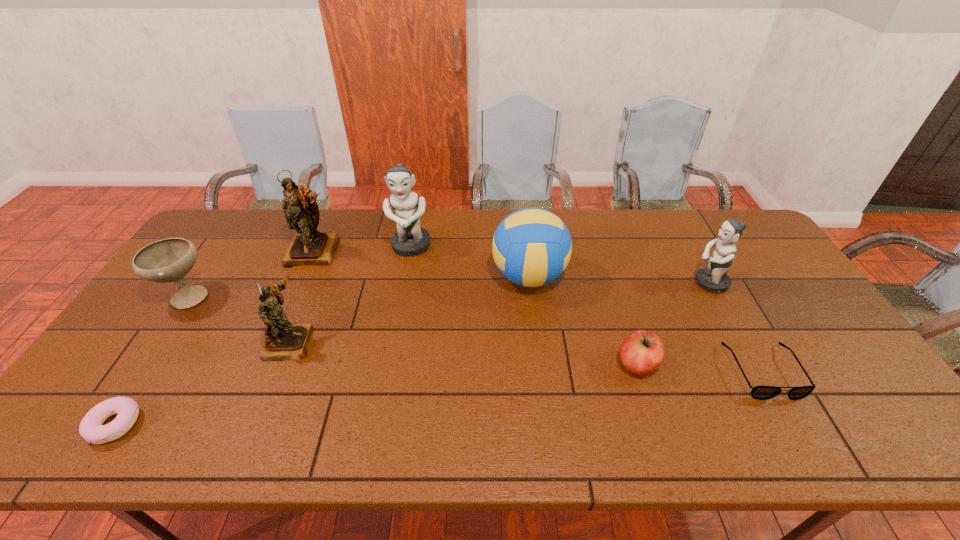
Where is `vacant point located between the volleyball and the spectacles`? vacant point located between the volleyball and the spectacles is located at coordinates (646, 324).

You are a GUI agent. You are given a task and a screenshot of the screen. Output one action in this format:
    pyautogui.click(x=<x>, y=<y>)
    Task: Click on the free space between the sixth tallest object and the pink doughnut
    This screenshot has width=960, height=540.
    Given the screenshot: What is the action you would take?
    pyautogui.click(x=152, y=360)

Where is `unoccupied area between the black spectacles and the seventh object from left to right`? This screenshot has width=960, height=540. unoccupied area between the black spectacles and the seventh object from left to right is located at coordinates (700, 368).

Select which object is the second closest to the smaller gold figurine. Please provide its 2D coordinates. Your answer should be formatted as a tuple, i.e. [(x, y)], where the tuple contains the x and y coordinates of a point satisfying the conditions above.

[(309, 247)]

Where is `object that can be found as the fourth closest to the third shortest object`? This screenshot has height=540, width=960. object that can be found as the fourth closest to the third shortest object is located at coordinates (410, 239).

Identify the location of the closest figurine to the spectacles. (714, 278).

Identify which figurine is the second nearest to the seventh object from left to right. Please provide its 2D coordinates. Your answer should be formatted as a tuple, i.e. [(x, y)], where the tuple contains the x and y coordinates of a point satisfying the conditions above.

[(410, 239)]

The image size is (960, 540). What are the coordinates of `vacant point that satisfies the following two spatial constraints: 1. on the front-facing side of the farther green figurine; 2. on the front-facing side of the nearer gold figurine` in the screenshot? It's located at [x=394, y=341].

Where is `vacant space that satisfies the following two spatial constraints: 1. on the front-facing side of the nearer gold figurine; 2. on the left side of the third shortest object`? This screenshot has height=540, width=960. vacant space that satisfies the following two spatial constraints: 1. on the front-facing side of the nearer gold figurine; 2. on the left side of the third shortest object is located at coordinates tap(280, 364).